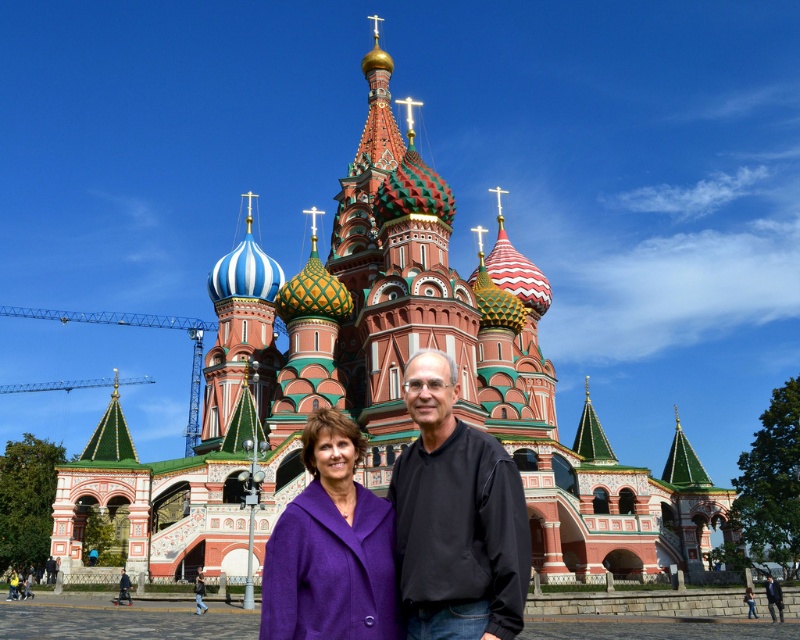
Question: Estimate the real-world distances between objects in this image. Which object is closer to the purple woolen coat at center?

Choices:
 (A) black smooth suit at center
 (B) black matte shirt at center

Answer: (B)

Question: Which of the following is the farthest from the observer?

Choices:
 (A) black smooth suit at center
 (B) black matte shirt at center
 (C) purple woolen coat at center

Answer: (A)

Question: Considering the real-world distances, which object is farthest from the black smooth suit at center?

Choices:
 (A) purple woolen coat at center
 (B) black matte shirt at center

Answer: (A)

Question: Where is purple woolen coat at center located in relation to black smooth suit at center in the image?

Choices:
 (A) below
 (B) above

Answer: (B)

Question: Observing the image, what is the correct spatial positioning of black matte shirt at center in reference to purple woolen coat at center?

Choices:
 (A) left
 (B) right

Answer: (B)

Question: Can you confirm if black matte shirt at center is positioned to the left of purple woolen coat at center?

Choices:
 (A) no
 (B) yes

Answer: (A)